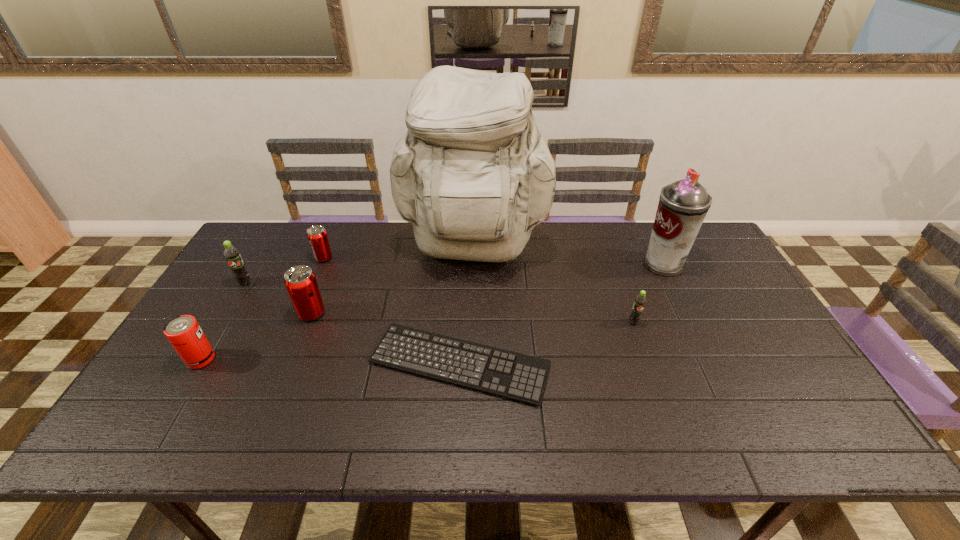
This screenshot has width=960, height=540. In the image, there is a desktop. In order to click on vacant space at the right edge in this screenshot , I will do `click(802, 409)`.

You are a GUI agent. You are given a task and a screenshot of the screen. Output one action in this format:
    pyautogui.click(x=<x>, y=<y>)
    Task: Click on the vacant area at the far left corner of the desktop
    This screenshot has width=960, height=540.
    Given the screenshot: What is the action you would take?
    pyautogui.click(x=258, y=239)

This screenshot has width=960, height=540. In order to click on empty location between the smaller green soda and the shortest object in this screenshot , I will do `click(547, 343)`.

Locate an element on the screen. This screenshot has height=540, width=960. vacant space that is in between the aerosol can and the can is located at coordinates (432, 312).

Find the location of a particular element. The image size is (960, 540). vacant space that is in between the rightmost object and the nearer red soda can is located at coordinates (488, 289).

At what (x,y) coordinates should I click in order to perform the action: click on free space between the third nearest soda and the aerosol can. Please return your answer as a coordinate pair (x, y). Image resolution: width=960 pixels, height=540 pixels. Looking at the image, I should click on (454, 273).

Locate an element on the screen. Image resolution: width=960 pixels, height=540 pixels. blank region between the computer keyboard and the backpack is located at coordinates (467, 308).

You are a GUI agent. You are given a task and a screenshot of the screen. Output one action in this format:
    pyautogui.click(x=<x>, y=<y>)
    Task: Click on the blank region between the leftmost soda and the smaller green soda
    
    Given the screenshot: What is the action you would take?
    pyautogui.click(x=439, y=302)

In order to click on free point between the black computer keyboard and the backpack in this screenshot , I will do `click(467, 308)`.

Where is `free space that is in between the farthest soda and the tallest object`? Image resolution: width=960 pixels, height=540 pixels. free space that is in between the farthest soda and the tallest object is located at coordinates (398, 255).